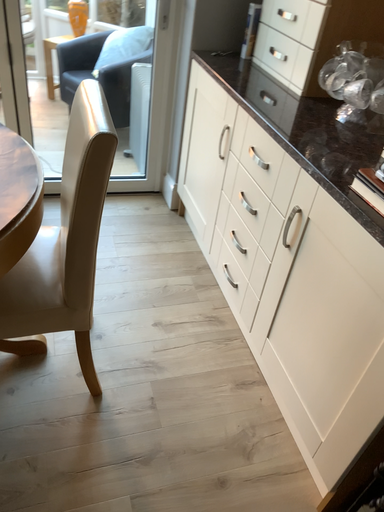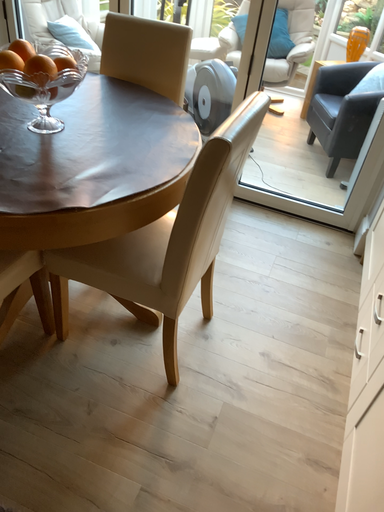
Question: Which way did the camera rotate in the video?

Choices:
 (A) rotated downward
 (B) rotated upward

Answer: (B)